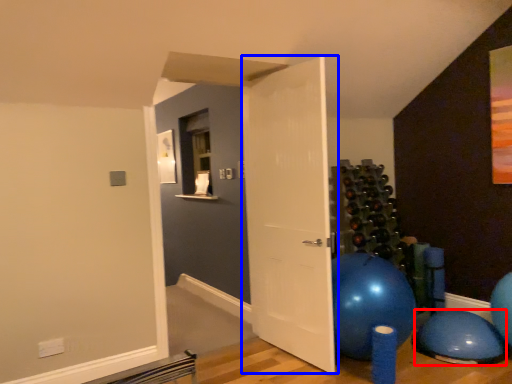
Question: Which point is closer to the camera, balloon (highlighted by a red box) or door (highlighted by a blue box)?

Choices:
 (A) balloon
 (B) door

Answer: (B)